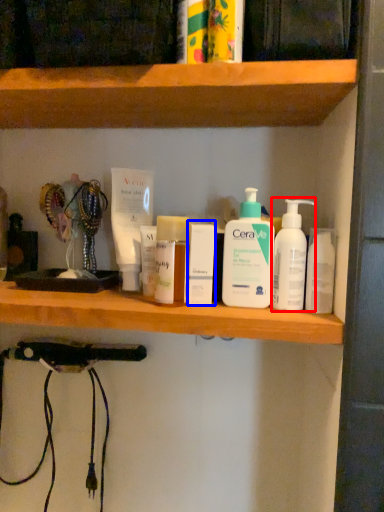
Question: Which object appears farthest to the camera in this image, cleaning product (highlighted by a red box) or toiletry (highlighted by a blue box)?

Choices:
 (A) cleaning product
 (B) toiletry

Answer: (B)